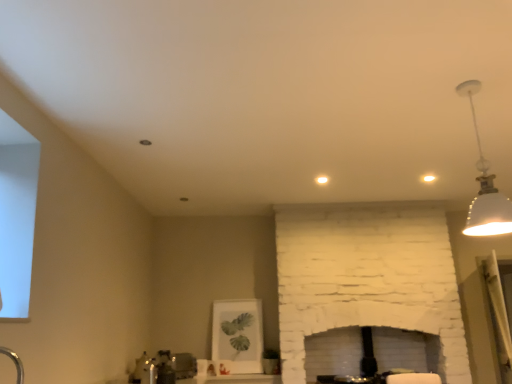
Question: Is white glossy sink at lower center looking in the opposite direction of white matte pendant light at upper right?

Choices:
 (A) yes
 (B) no

Answer: (B)

Question: Considering the relative positions of white glossy sink at lower center and white matte pendant light at upper right in the image provided, is white glossy sink at lower center in front of white matte pendant light at upper right?

Choices:
 (A) no
 (B) yes

Answer: (A)

Question: Is white glossy sink at lower center bigger than white matte pendant light at upper right?

Choices:
 (A) no
 (B) yes

Answer: (A)

Question: From a real-world perspective, is white glossy sink at lower center below white matte pendant light at upper right?

Choices:
 (A) yes
 (B) no

Answer: (A)

Question: From the image's perspective, is white glossy sink at lower center located beneath white matte pendant light at upper right?

Choices:
 (A) no
 (B) yes

Answer: (B)

Question: Is satin nickel faucet at lower center inside or outside of white matte pendant light at upper right?

Choices:
 (A) outside
 (B) inside

Answer: (A)

Question: From the image's perspective, is satin nickel faucet at lower center above or below white matte pendant light at upper right?

Choices:
 (A) above
 (B) below

Answer: (B)

Question: From a real-world perspective, is satin nickel faucet at lower center above or below white matte pendant light at upper right?

Choices:
 (A) below
 (B) above

Answer: (A)

Question: Is satin nickel faucet at lower center in front of or behind white matte pendant light at upper right in the image?

Choices:
 (A) front
 (B) behind

Answer: (B)

Question: From a real-world perspective, relative to white glossy sink at lower center, is satin nickel faucet at lower center vertically above or below?

Choices:
 (A) below
 (B) above

Answer: (A)

Question: Looking at their shapes, would you say satin nickel faucet at lower center is wider or thinner than white glossy sink at lower center?

Choices:
 (A) thin
 (B) wide

Answer: (A)

Question: Is satin nickel faucet at lower center to the left or to the right of white glossy sink at lower center in the image?

Choices:
 (A) right
 (B) left

Answer: (B)

Question: In terms of height, does satin nickel faucet at lower center look taller or shorter compared to white glossy sink at lower center?

Choices:
 (A) tall
 (B) short

Answer: (B)

Question: Considering the positions of white glossy sink at lower center and satin nickel faucet at lower center in the image, is white glossy sink at lower center bigger or smaller than satin nickel faucet at lower center?

Choices:
 (A) big
 (B) small

Answer: (A)

Question: Does point (138, 380) appear closer or farther from the camera than point (150, 380)?

Choices:
 (A) closer
 (B) farther

Answer: (B)